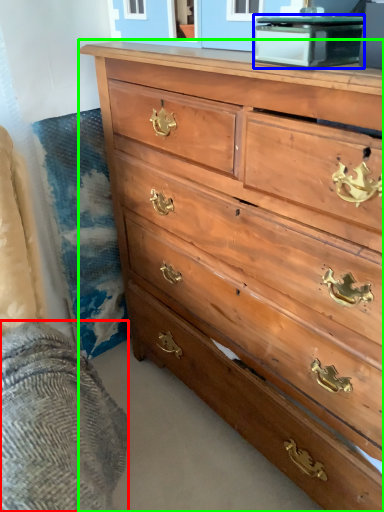
Question: Which object is positioned closest to bedding (highlighted by a red box)? Select from cabinetry (highlighted by a blue box) and chest of drawers (highlighted by a green box).

Choices:
 (A) cabinetry
 (B) chest of drawers

Answer: (B)